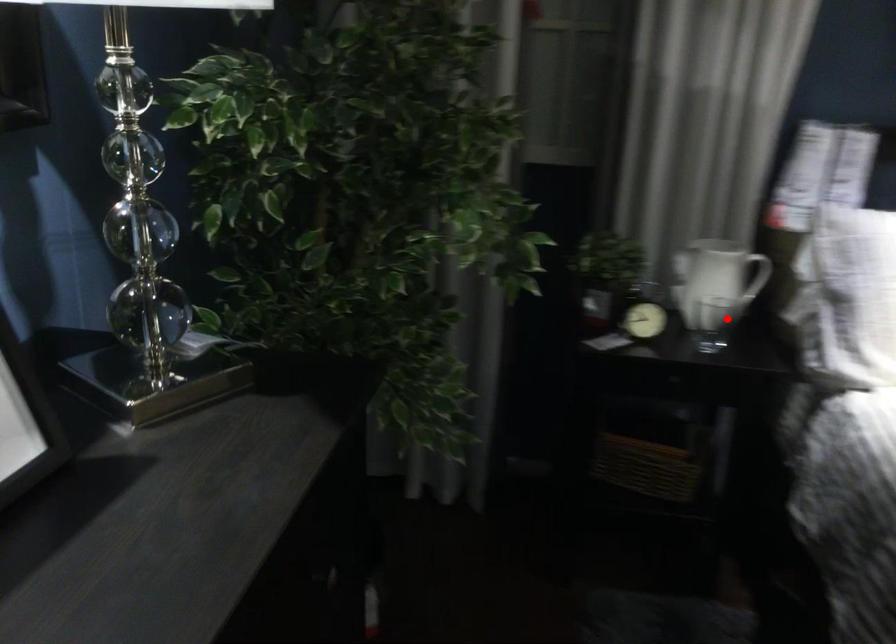
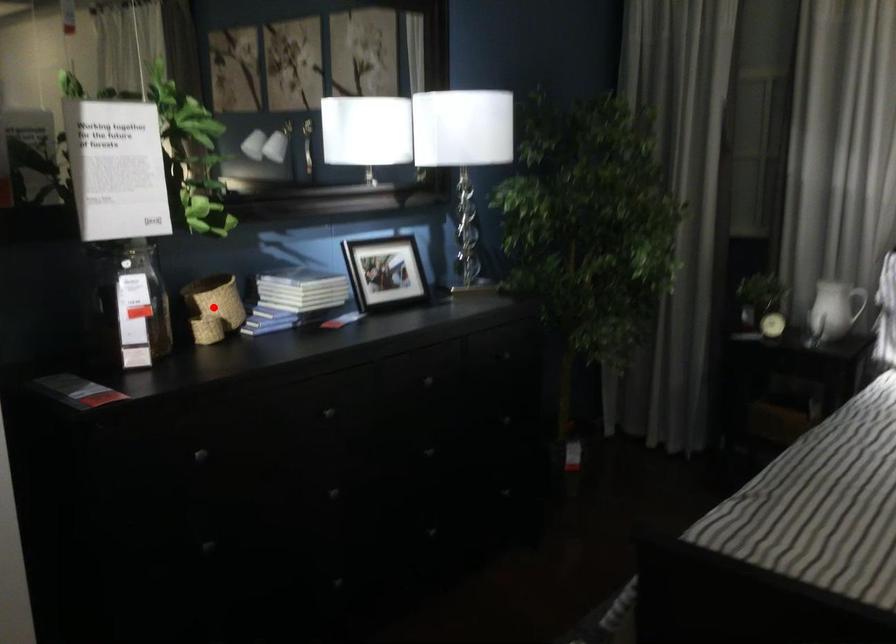
Looking at this image, I am providing you with two images of the same scene from different viewpoints. A red point is marked on the first image and another point is marked on the second image. Is the red point in image1 aligned with the point shown in image2?

No